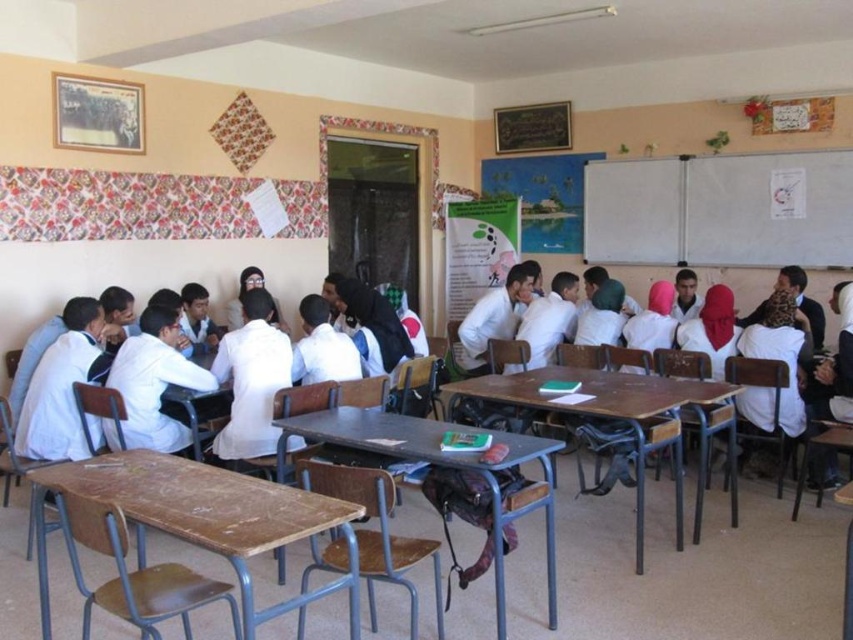
You are a student in the classroom and need to place a tall textbook on a surface. Which object between the wooden desk at center and the wooden table at center would be more suitable for placing the tall textbook?

The wooden desk at center has a greater height compared to the wooden table at center, so it would be more suitable for placing the tall textbook as it provides a stable and elevated surface.

You are a student in the classroom and need to place a 15 cm wide textbook on either the wooden desk at center or the wooden table at center. Which surface can accommodate the textbook without it hanging over the edge?

The wooden table at center can accommodate the textbook since it is wider than the wooden desk at center, which is thinner and might not provide enough space for the 15 cm wide textbook.